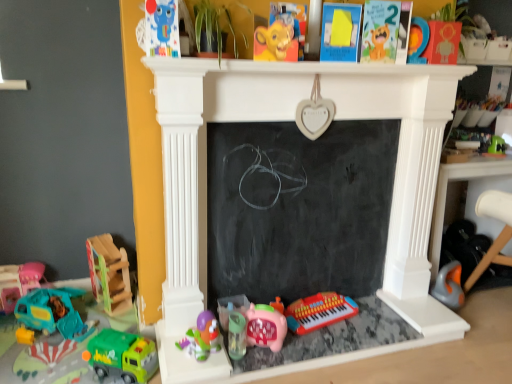
Where is `vacant area situated below wooden chair at right (from a real-world perspective)`? This screenshot has height=384, width=512. vacant area situated below wooden chair at right (from a real-world perspective) is located at coordinates (496, 306).